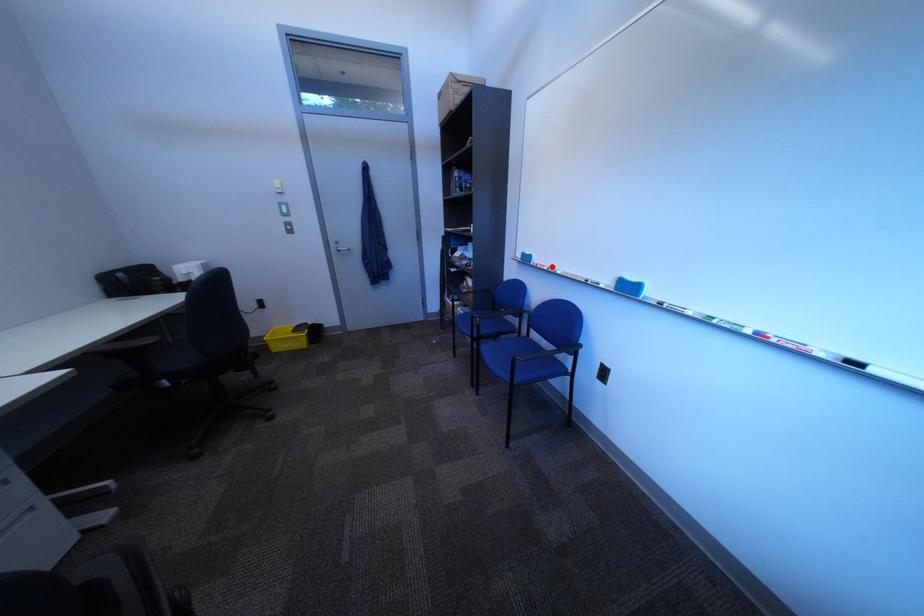
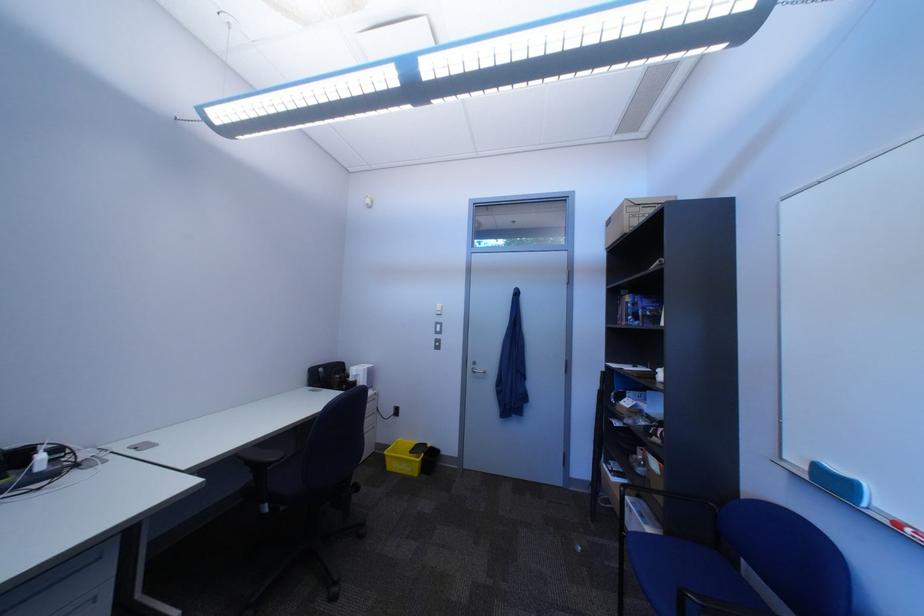
Where in the second image is the point corresponding to the highlighted location from the first image?

(915, 527)